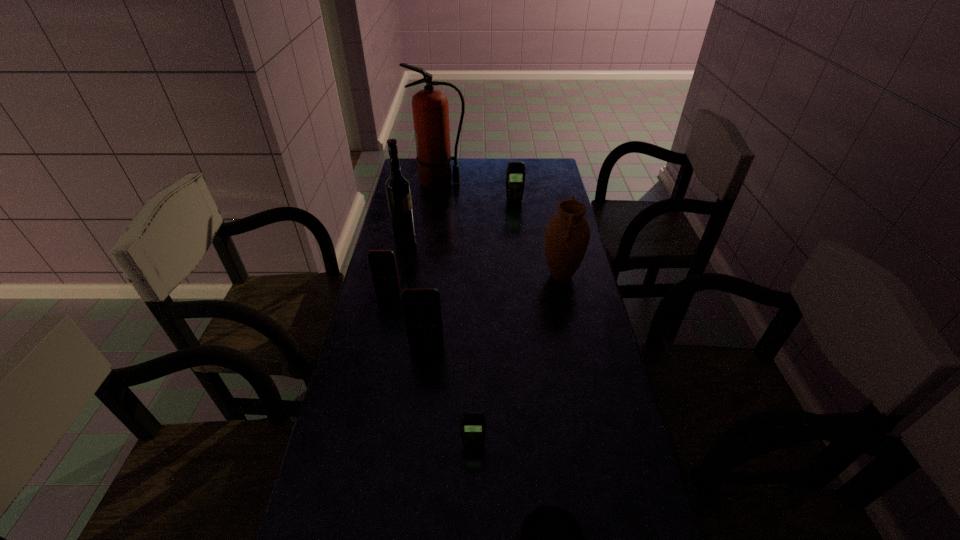
The image size is (960, 540). What are the coordinates of `the second farthest cellular telephone` in the screenshot? It's located at (383, 266).

At what (x,y) coordinates should I click in order to perform the action: click on the smaller orange cellular telephone. Please return your answer as a coordinate pair (x, y). The height and width of the screenshot is (540, 960). Looking at the image, I should click on (383, 266).

Image resolution: width=960 pixels, height=540 pixels. In order to click on the fourth object from right to left in this screenshot , I will do `click(472, 424)`.

Where is `the nearer gray cellular telephone`? the nearer gray cellular telephone is located at coordinates (472, 424).

What are the coordinates of `free point located on the nozzle of the fire extinguisher` in the screenshot? It's located at (529, 183).

You are a GUI agent. You are given a task and a screenshot of the screen. Output one action in this format:
    pyautogui.click(x=<x>, y=<y>)
    Task: Click on the blank space located 0.230m on the front and back of the second tallest object
    The width and height of the screenshot is (960, 540).
    Given the screenshot: What is the action you would take?
    pyautogui.click(x=477, y=239)

The height and width of the screenshot is (540, 960). I want to click on vacant space situated 0.170m on the back of the rightmost object, so click(552, 233).

This screenshot has width=960, height=540. I want to click on vacant area situated on the screen of the third cellular telephone from right to left, so click(x=421, y=394).

Locate an element on the screen. vacant space located on the screen of the seventh nearest object is located at coordinates (520, 258).

Locate an element on the screen. free space located 0.350m on the screen of the smaller orange cellular telephone is located at coordinates (368, 388).